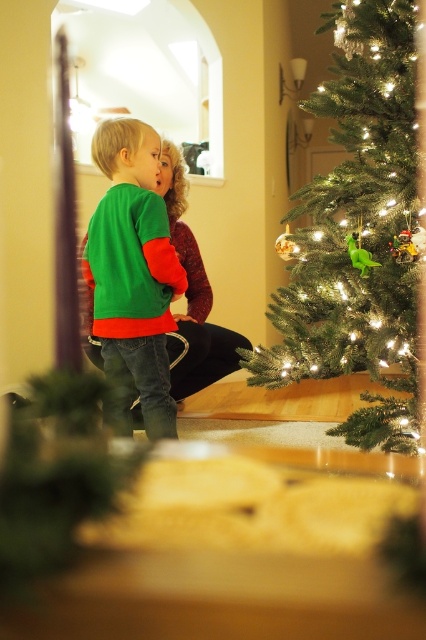
Question: Is green matte christmas tree at right bigger than green matte sweater at center?

Choices:
 (A) no
 (B) yes

Answer: (B)

Question: Can you confirm if green matte christmas tree at right is positioned to the right of green matte sweater at center?

Choices:
 (A) yes
 (B) no

Answer: (A)

Question: Among these points, which one is nearest to the camera?

Choices:
 (A) (100, 218)
 (B) (339, 120)

Answer: (A)

Question: Which point appears farthest from the camera in this image?

Choices:
 (A) (405, 131)
 (B) (111, 346)

Answer: (B)

Question: Which object appears farthest from the camera in this image?

Choices:
 (A) green matte christmas tree at right
 (B) green matte sweater at center

Answer: (B)

Question: Can you confirm if green matte christmas tree at right is positioned below green matte sweater at center?

Choices:
 (A) no
 (B) yes

Answer: (A)